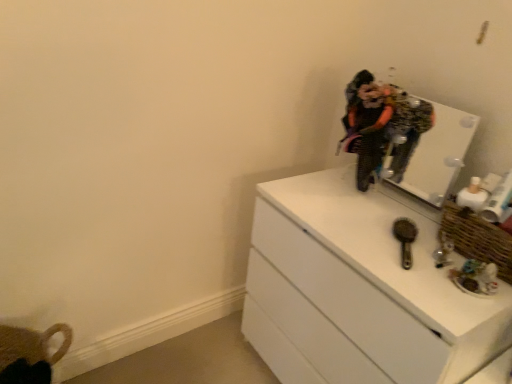
Question: Is metallic brown brush at center-right positioned beyond the bounds of white glossy chest of drawers at right?

Choices:
 (A) yes
 (B) no

Answer: (A)

Question: Is metallic brown brush at center-right oriented away from white glossy chest of drawers at right?

Choices:
 (A) no
 (B) yes

Answer: (A)

Question: Is metallic brown brush at center-right positioned far away from white glossy chest of drawers at right?

Choices:
 (A) yes
 (B) no

Answer: (B)

Question: Does metallic brown brush at center-right have a lesser height compared to white glossy chest of drawers at right?

Choices:
 (A) yes
 (B) no

Answer: (A)

Question: Is the depth of metallic brown brush at center-right greater than that of white glossy chest of drawers at right?

Choices:
 (A) no
 (B) yes

Answer: (B)

Question: From a real-world perspective, is woven brown basket at right physically located above or below white glossy mirror at upper right?

Choices:
 (A) above
 (B) below

Answer: (B)

Question: Looking at their shapes, would you say woven brown basket at right is wider or thinner than white glossy mirror at upper right?

Choices:
 (A) thin
 (B) wide

Answer: (B)

Question: From the image's perspective, relative to white glossy mirror at upper right, is woven brown basket at right above or below?

Choices:
 (A) above
 (B) below

Answer: (B)

Question: In terms of height, does woven brown basket at right look taller or shorter compared to white glossy mirror at upper right?

Choices:
 (A) tall
 (B) short

Answer: (B)

Question: Considering their positions, is metallic brown brush at center-right located in front of or behind woven brown basket at right?

Choices:
 (A) front
 (B) behind

Answer: (B)

Question: In terms of size, does metallic brown brush at center-right appear bigger or smaller than woven brown basket at right?

Choices:
 (A) small
 (B) big

Answer: (A)

Question: From a real-world perspective, is metallic brown brush at center-right positioned above or below woven brown basket at right?

Choices:
 (A) below
 (B) above

Answer: (A)

Question: Considering the positions of metallic brown brush at center-right and woven brown basket at right in the image, is metallic brown brush at center-right taller or shorter than woven brown basket at right?

Choices:
 (A) short
 (B) tall

Answer: (A)

Question: Is white glossy chest of drawers at right bigger or smaller than white glossy mirror at upper right?

Choices:
 (A) small
 (B) big

Answer: (B)

Question: In terms of width, does white glossy chest of drawers at right look wider or thinner when compared to white glossy mirror at upper right?

Choices:
 (A) thin
 (B) wide

Answer: (B)